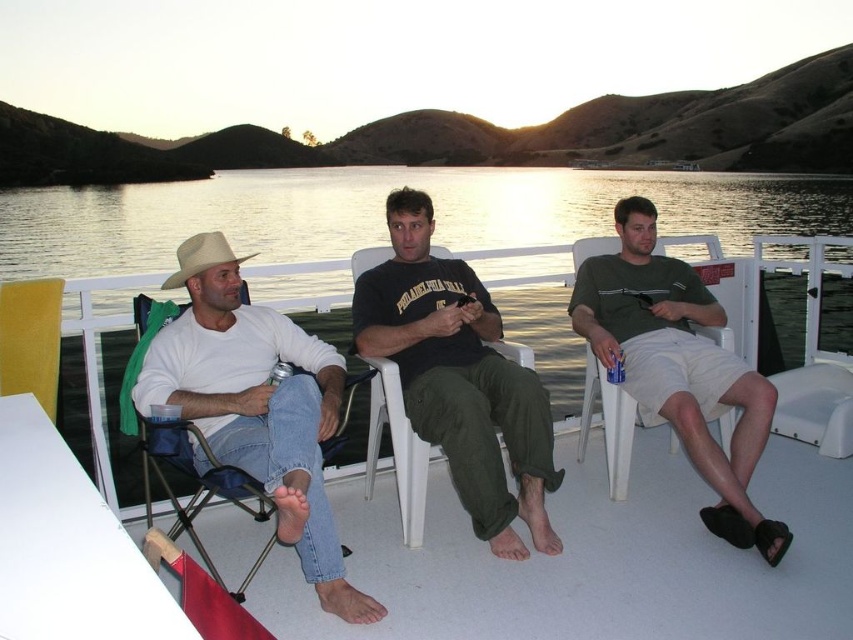
Question: Does white matte shirt at left have a lesser width compared to beige felt cowboy hat at left?

Choices:
 (A) yes
 (B) no

Answer: (B)

Question: Is black matte shirt at center to the right of beige felt cowboy hat at left from the viewer's perspective?

Choices:
 (A) yes
 (B) no

Answer: (A)

Question: Which point is closer to the camera taking this photo?

Choices:
 (A) (206, 230)
 (B) (56, 545)

Answer: (B)

Question: Which point appears farthest from the camera in this image?

Choices:
 (A) (608, 420)
 (B) (230, 260)

Answer: (A)

Question: Considering the relative positions of glistening water at center and beige felt cowboy hat at left in the image provided, where is glistening water at center located with respect to beige felt cowboy hat at left?

Choices:
 (A) above
 (B) below

Answer: (A)

Question: Among these points, which one is nearest to the camera?

Choices:
 (A) click(x=274, y=412)
 (B) click(x=48, y=285)
 (C) click(x=456, y=488)
 (D) click(x=579, y=424)

Answer: (A)